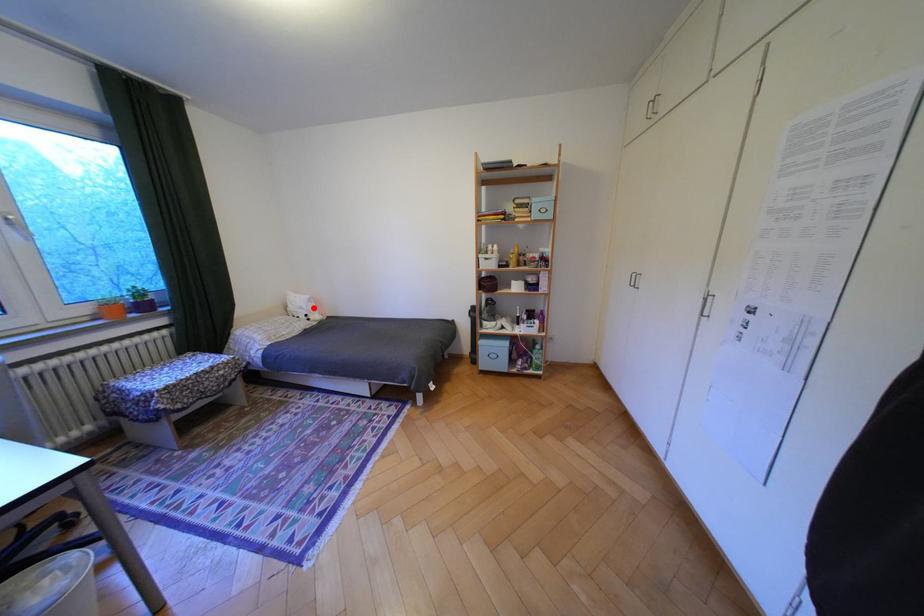
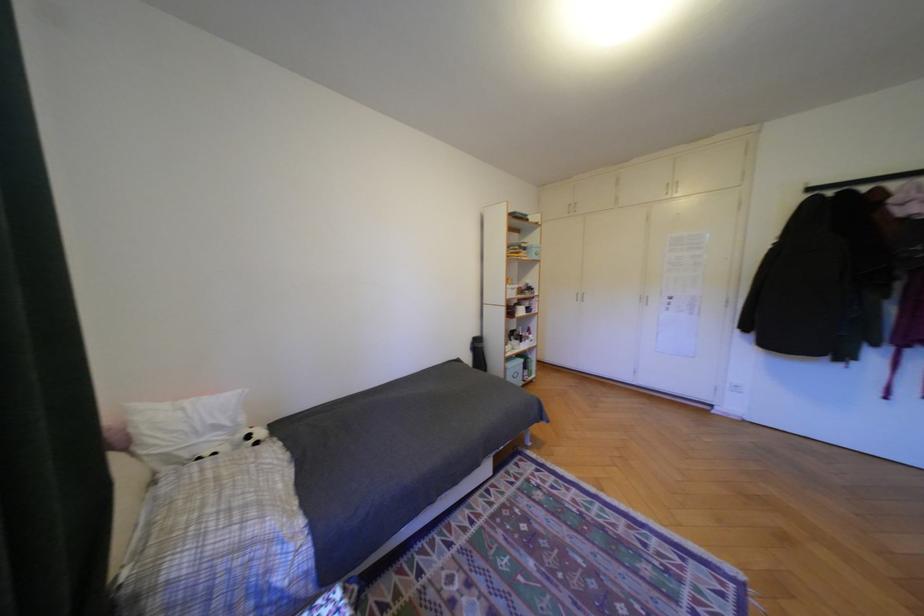
Question: A red point is marked in image1. In image2, is the corresponding 3D point closer to the camera or farther? Reply with the corresponding letter.

Choices:
 (A) The corresponding 3D point is closer.
 (B) The corresponding 3D point is farther.

Answer: (B)